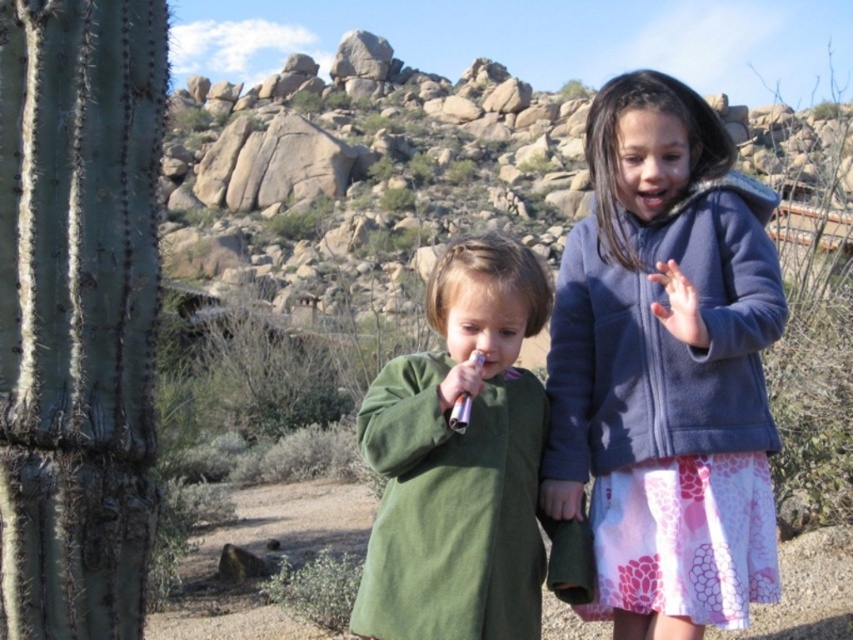
You are a photographer setting up a camera at the center of the scene. You want to capture both the blue fleece jacket at center and the green fleece jacket at center in a single shot. The camera has a maximum horizontal field of view of 2 meters. Can you fit both jackets in the frame without moving the camera?

The blue fleece jacket at center and green fleece jacket at center are 2.21 meters apart from each other. Since the camera can only capture 2 meters in the horizontal field of view, the distance between them exceeds the camera capabilities. Therefore, both jackets cannot be captured in a single frame without moving the camera.

You are a photographer trying to capture a photo of both the blue fleece jacket at center and the green fleece jacket at center. Since you want them to be the same height in the photo, which jacket should you move closer to the camera?

The blue fleece jacket at center is taller than the green fleece jacket at center. To make them appear the same height in the photo, move the shorter green fleece jacket at center closer to the camera.

You are a photographer trying to capture a photo of the blue fleece jacket at center and the green fleece jacket at center. Which jacket should you focus on first if you want to ensure both are in the frame without moving the camera?

The blue fleece jacket at center is above the green fleece jacket at center, so you should focus on the blue fleece jacket at center first to ensure both are in the frame without moving the camera.